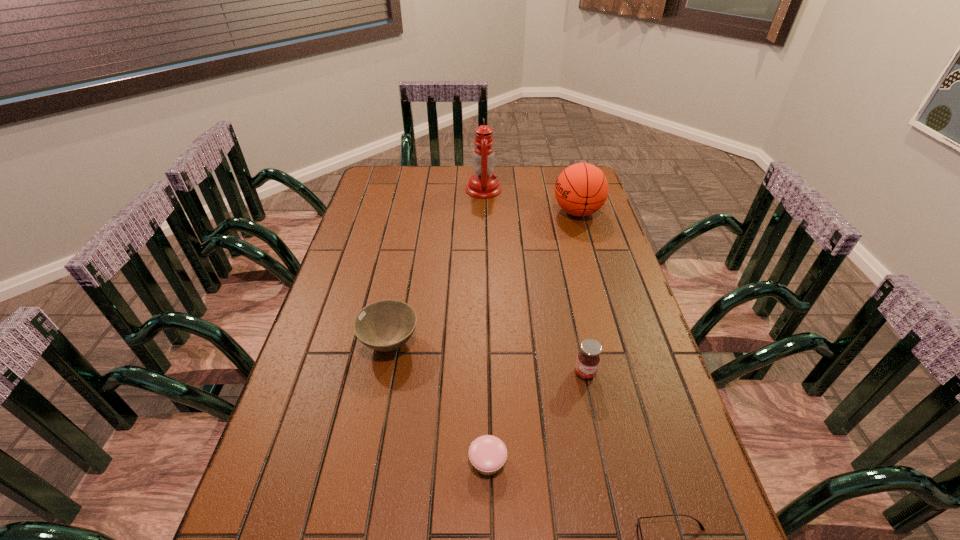
In order to click on free region located on the side with logo of the fifth shortest object in this screenshot , I will do `click(504, 212)`.

Locate an element on the screen. The width and height of the screenshot is (960, 540). vacant space located 0.230m on the label side of the jam is located at coordinates (607, 475).

Where is `vacant space located 0.230m on the right of the bowl`? vacant space located 0.230m on the right of the bowl is located at coordinates click(x=505, y=343).

Where is `vacant region located 0.220m on the back of the cupcake`? The height and width of the screenshot is (540, 960). vacant region located 0.220m on the back of the cupcake is located at coordinates (487, 363).

Identify the location of object that is positioned at the far edge. The image size is (960, 540). (483, 185).

Locate an element on the screen. object that is at the left edge is located at coordinates (386, 325).

What are the coordinates of `object positioned at the right edge` in the screenshot? It's located at (581, 189).

In the image, there is a desktop. In order to click on vacant space at the far edge in this screenshot , I will do point(416,170).

Where is `vacant space at the left edge`? vacant space at the left edge is located at coordinates (368, 261).

In the image, there is a desktop. Where is `vacant space at the right edge`? vacant space at the right edge is located at coordinates (604, 260).